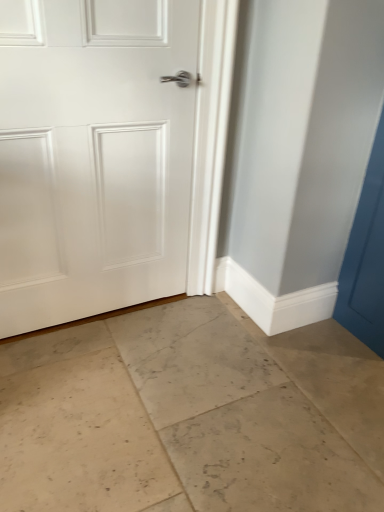
Question: Considering their positions, is beige marble floor at center located in front of or behind white matte door at center?

Choices:
 (A) front
 (B) behind

Answer: (A)

Question: Considering the positions of beige marble floor at center and white matte door at center in the image, is beige marble floor at center bigger or smaller than white matte door at center?

Choices:
 (A) big
 (B) small

Answer: (A)

Question: In terms of width, does beige marble floor at center look wider or thinner when compared to white matte door at center?

Choices:
 (A) thin
 (B) wide

Answer: (B)

Question: Is point (99, 251) positioned closer to the camera than point (82, 490)?

Choices:
 (A) farther
 (B) closer

Answer: (A)

Question: From the image's perspective, relative to beige marble floor at center, is white matte door at center above or below?

Choices:
 (A) above
 (B) below

Answer: (A)

Question: Would you say white matte door at center is inside or outside beige marble floor at center?

Choices:
 (A) inside
 (B) outside

Answer: (B)

Question: Looking at their shapes, would you say white matte door at center is wider or thinner than beige marble floor at center?

Choices:
 (A) thin
 (B) wide

Answer: (A)